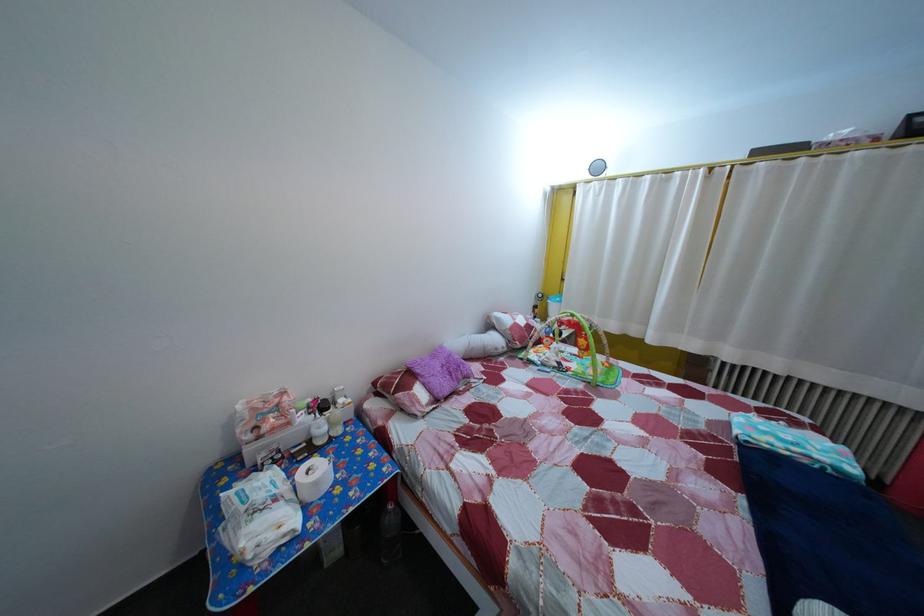
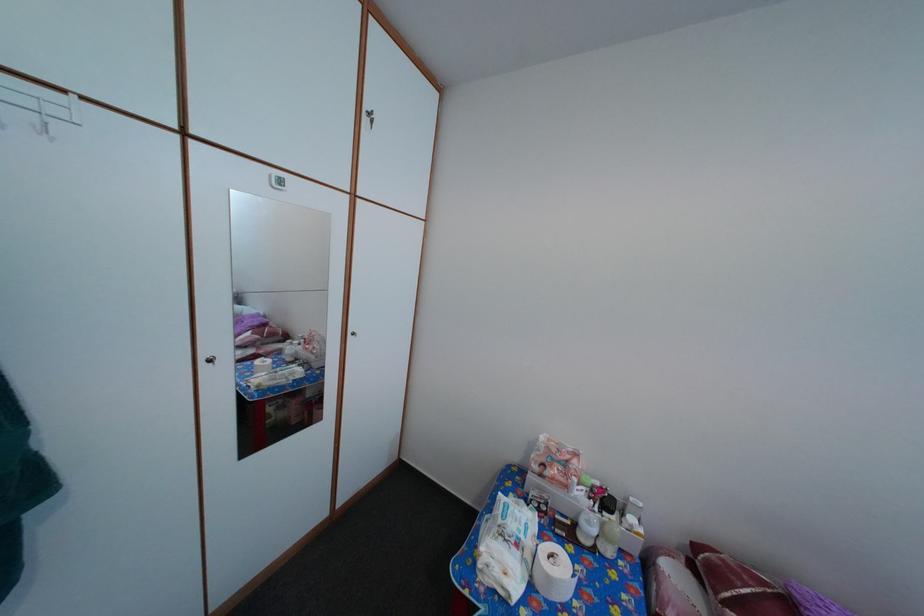
In the second image, find the point that corresponds to point (286, 414) in the first image.

(576, 469)